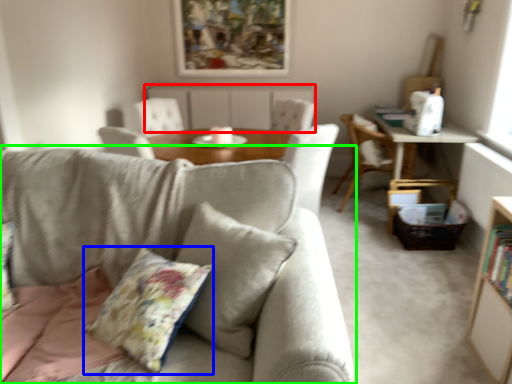
Question: Considering the real-world distances, which object is closest to beige (highlighted by a red box)? throw pillow (highlighted by a blue box) or studio couch (highlighted by a green box).

Choices:
 (A) throw pillow
 (B) studio couch

Answer: (B)